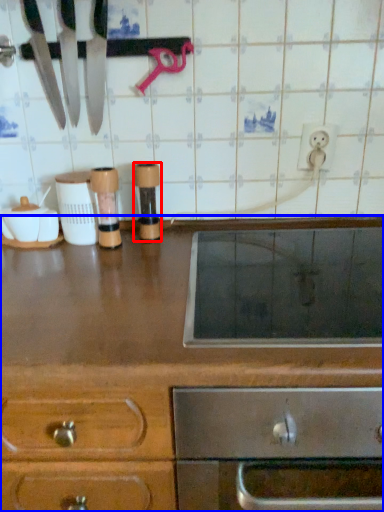
Question: Which object is closer to the camera taking this photo, appliance (highlighted by a red box) or cabinetry (highlighted by a blue box)?

Choices:
 (A) appliance
 (B) cabinetry

Answer: (B)